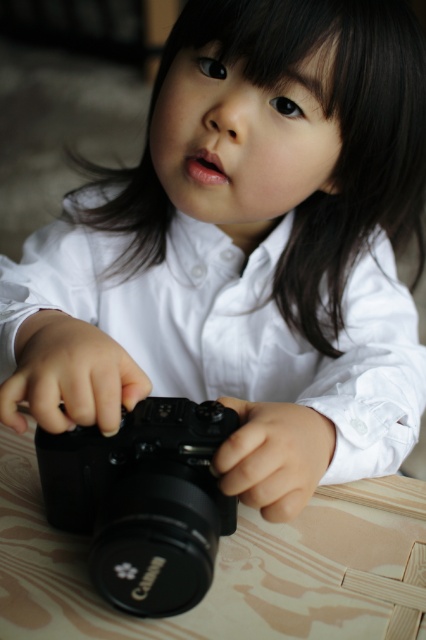
You are setting up a photo shoot and need to place a wooden table at center in the scene. Where should you position it?

The wooden table at center should be positioned at point 0.886 on the x axis and 0.516 on the y axis.